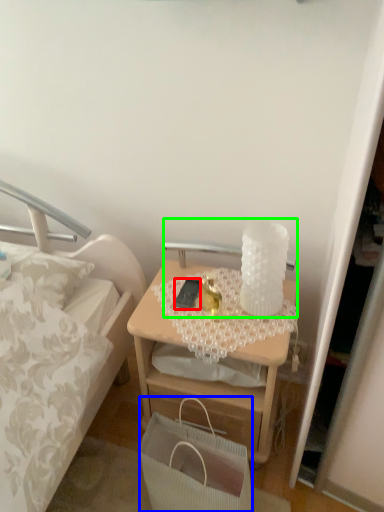
Question: Based on their relative distances, which object is nearer to mobile phone (highlighted by a red box)? Choose from handbag (highlighted by a blue box) and table lamp (highlighted by a green box).

Choices:
 (A) handbag
 (B) table lamp

Answer: (B)